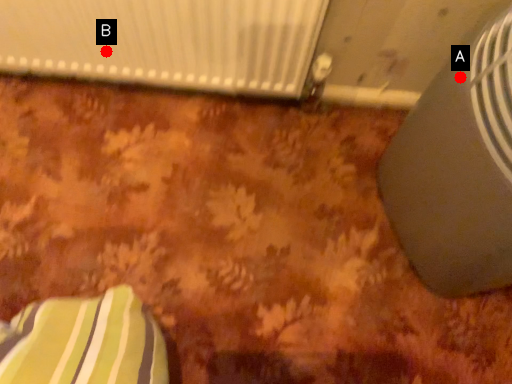
Question: Two points are circled on the image, labeled by A and B beside each circle. Among these points, which one is nearest to the camera?

Choices:
 (A) A is closer
 (B) B is closer

Answer: (A)